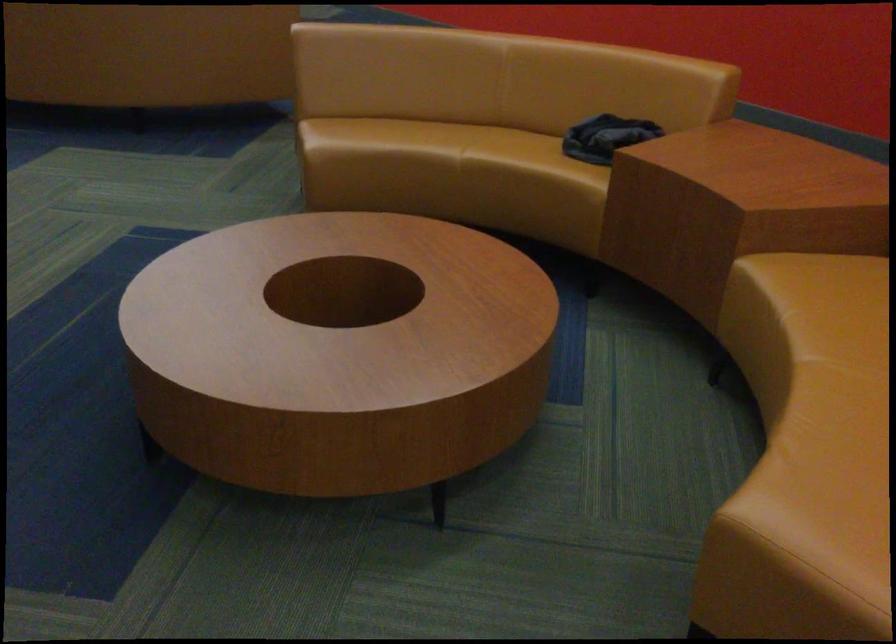
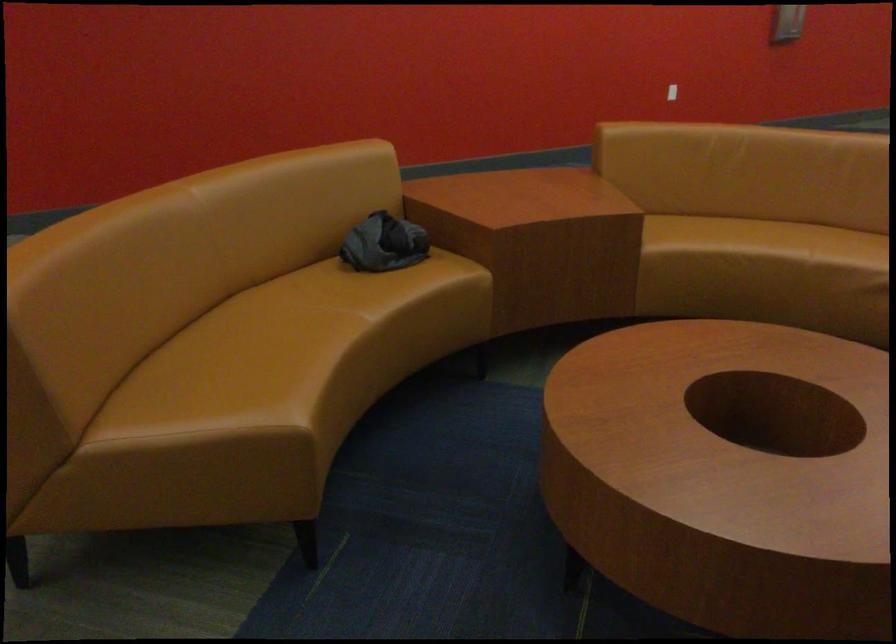
Where in the second image is the point corresponding to point 579,129 from the first image?

(383, 243)